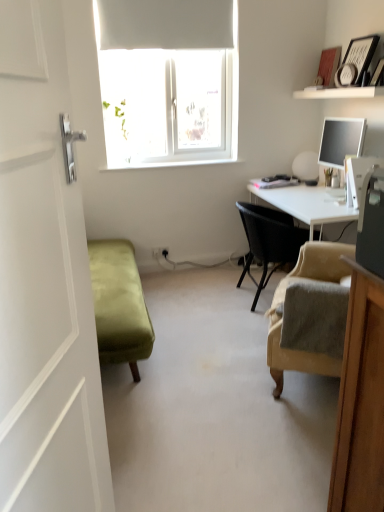
Locate an element on the screen. This screenshot has height=512, width=384. vacant space underneath white matte table lamp at right (from a real-world perspective) is located at coordinates (303, 180).